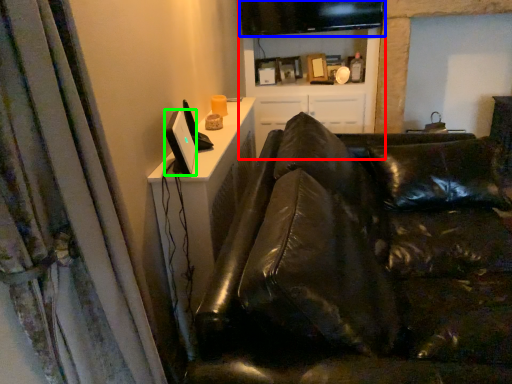
Question: Which is farther away from entertainment center (highlighted by a red box)? computer monitor (highlighted by a blue box) or computer monitor (highlighted by a green box)?

Choices:
 (A) computer monitor
 (B) computer monitor

Answer: (B)